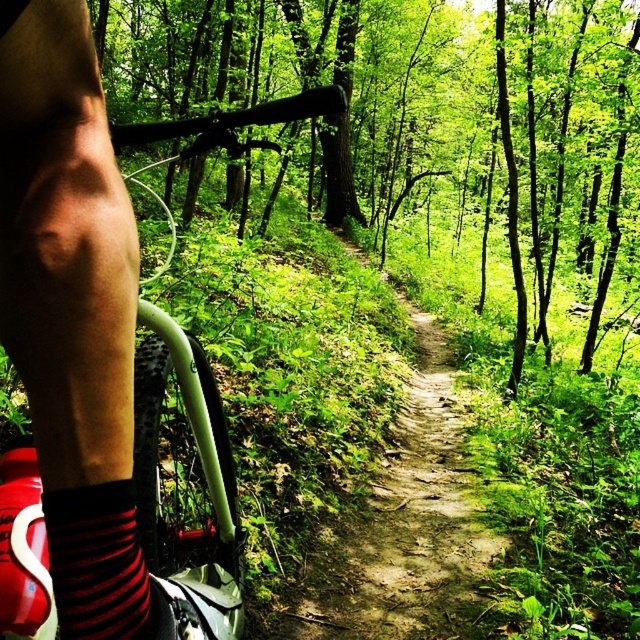
You are riding a bicycle through a forest trail and notice the green matte mountain bike at left and the red striped sock at lower left. Which object is higher up in your field of view?

The green matte mountain bike at left is much taller than the red striped sock at lower left, so it appears higher up in your field of view.

You are riding a bicycle through a forest trail and want to grab an object located at point (64,547). Your arm can reach up to 16 inches. Can you reach it?

The point (64,547) is 16.56 inches from the viewer, which is slightly beyond your arm reach of 16 inches. You cannot reach it.